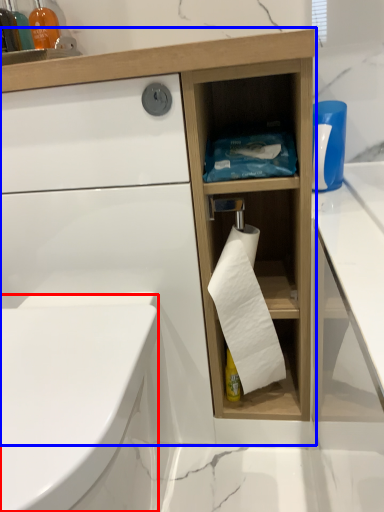
Question: Which point is further to the camera, bidet (highlighted by a red box) or bathroom cabinet (highlighted by a blue box)?

Choices:
 (A) bidet
 (B) bathroom cabinet

Answer: (B)